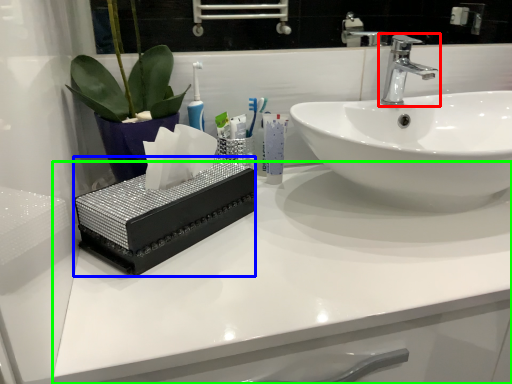
Question: Considering the real-world distances, which object is farthest from tap (highlighted by a red box)? box (highlighted by a blue box) or counter top (highlighted by a green box)?

Choices:
 (A) box
 (B) counter top

Answer: (A)